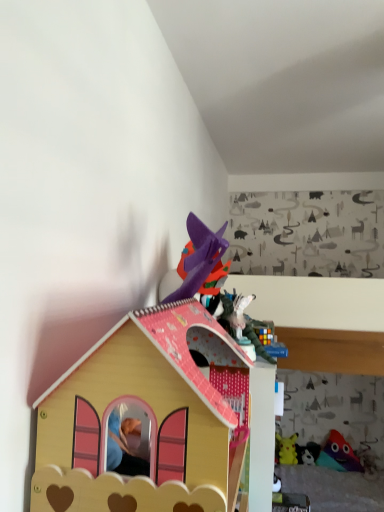
Where is `empty space that is ontop of multicolored plush toy at lower right, positioned as the 4th toy in bottom-to-top order (from a real-world perspective)`? empty space that is ontop of multicolored plush toy at lower right, positioned as the 4th toy in bottom-to-top order (from a real-world perspective) is located at coordinates (337, 430).